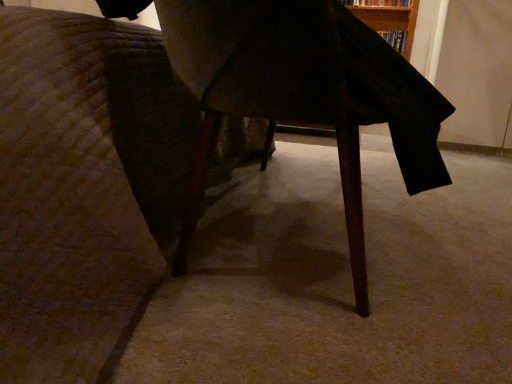
This screenshot has height=384, width=512. What do you see at coordinates (302, 93) in the screenshot? I see `wooden table at center` at bounding box center [302, 93].

Measure the distance between hardcover book at upper right and camera.

hardcover book at upper right and camera are 3.04 meters apart.

I want to click on wooden table at center, so click(x=83, y=185).

You are a GUI agent. You are given a task and a screenshot of the screen. Output one action in this format:
    pyautogui.click(x=<x>, y=<y>)
    Task: Click on the wooden table at center
    
    Given the screenshot: What is the action you would take?
    pyautogui.click(x=302, y=93)

From a real-world perspective, is hardcover book at upper right located beneath wooden table at center?

No, from a real-world perspective, hardcover book at upper right is not under wooden table at center.

Could you tell me if hardcover book at upper right is turned towards wooden table at center?

No, hardcover book at upper right is not aimed at wooden table at center.

Which of these two, hardcover book at upper right or wooden table at center, stands shorter?

hardcover book at upper right.

From a real-world perspective, relative to wooden table at center, is hardcover book at upper right vertically above or below?

In terms of real-world spatial position, hardcover book at upper right is above wooden table at center.

How far apart are hardcover book at upper right and wooden table at center?

hardcover book at upper right and wooden table at center are 2.51 meters apart.

From the image's perspective, which object appears higher, hardcover book at upper right or wooden table at center?

hardcover book at upper right is shown above in the image.

Is hardcover book at upper right further to the viewer compared to wooden table at center?

Yes, hardcover book at upper right is behind wooden table at center.

Where is `table below the hardcover book at upper right (from the image's perspective)`? table below the hardcover book at upper right (from the image's perspective) is located at coordinates (302, 93).

Which is nearer, (x=164, y=26) or (x=405, y=35)?

The point (x=164, y=26) is more forward.

From a real-world perspective, does wooden table at center stand above hardcover book at upper right?

No, from a real-world perspective, wooden table at center is not over hardcover book at upper right

Are wooden table at center and hardcover book at upper right located far from each other?

Yes, wooden table at center and hardcover book at upper right are located far from each other.

Which object is positioned more to the right, wooden table at center or wooden table at center?

Positioned to the right is wooden table at center.

Between wooden table at center and wooden table at center, which one is positioned in front?

Positioned in front is wooden table at center.

Can you tell me how much wooden table at center and wooden table at center differ in facing direction?

There is a 2.82-degree angle between the facing directions of wooden table at center and wooden table at center.

From a real-world perspective, which object stands above the other?

In real-world perspective, wooden table at center is above.

From a real-world perspective, is wooden table at center physically located above or below hardcover book at upper right?

In terms of real-world spatial position, wooden table at center is below hardcover book at upper right.

Is wooden table at center positioned with its back to hardcover book at upper right?

No, wooden table at center is not facing the opposite direction of hardcover book at upper right.

Can you confirm if wooden table at center is thinner than wooden table at center?

In fact, wooden table at center might be wider than wooden table at center.

Is wooden table at center not close to wooden table at center?

No.

From a real-world perspective, who is located lower, wooden table at center or wooden table at center?

wooden table at center is physically lower.

How different are the orientations of wooden table at center and wooden table at center in degrees?

They differ by 2.82 degrees in their facing directions.

Locate an element on the screen. furniture on the left of hardcover book at upper right is located at coordinates (83, 185).

Where is `book located above the wooden table at center (from the image's perspective)`? book located above the wooden table at center (from the image's perspective) is located at coordinates (395, 39).

From the image, which object appears to be farther from wooden table at center, hardcover book at upper right or wooden table at center?

hardcover book at upper right.

Which object lies further to the anchor point wooden table at center, hardcover book at upper right or wooden table at center?

The object further to wooden table at center is hardcover book at upper right.

Estimate the real-world distances between objects in this image. Which object is further from hardcover book at upper right, wooden table at center or wooden table at center?

wooden table at center is further to hardcover book at upper right.

Estimate the real-world distances between objects in this image. Which object is further from hardcover book at upper right, wooden table at center or wooden table at center?

wooden table at center is further to hardcover book at upper right.

Which object lies further to the anchor point wooden table at center, wooden table at center or hardcover book at upper right?

hardcover book at upper right lies further to wooden table at center than the other object.

From the image, which object appears to be farther from wooden table at center, wooden table at center or hardcover book at upper right?

Based on the image, hardcover book at upper right appears to be further to wooden table at center.

Where is `table between wooden table at center and hardcover book at upper right in the front-back direction`? The width and height of the screenshot is (512, 384). table between wooden table at center and hardcover book at upper right in the front-back direction is located at coordinates (302, 93).